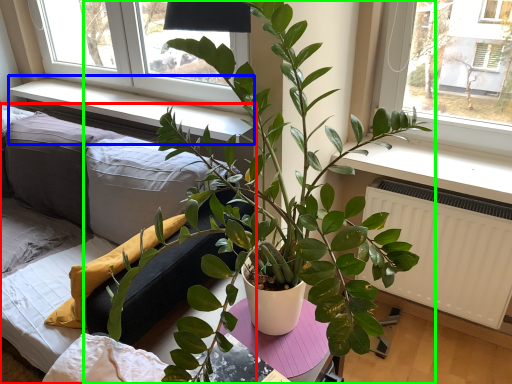
Question: Which object is positioned farthest from studio couch (highlighted by a red box)? Select from window sill (highlighted by a blue box) and houseplant (highlighted by a green box).

Choices:
 (A) window sill
 (B) houseplant

Answer: (B)